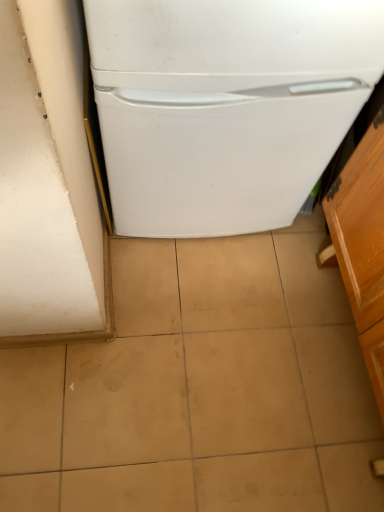
What do you see at coordinates (225, 106) in the screenshot? I see `white matte refrigerator at center` at bounding box center [225, 106].

Find the location of a particular element. The height and width of the screenshot is (512, 384). white matte refrigerator at center is located at coordinates (225, 106).

Image resolution: width=384 pixels, height=512 pixels. Describe the element at coordinates (363, 244) in the screenshot. I see `wooden cabinet at right` at that location.

This screenshot has width=384, height=512. What are the coordinates of `wooden cabinet at right` in the screenshot? It's located at (363, 244).

Measure the distance between point (x=354, y=155) and camera.

They are 1.08 meters apart.

In order to click on white matte refrigerator at center in this screenshot , I will do `click(225, 106)`.

Considering the relative positions of wooden cabinet at right and white matte refrigerator at center in the image provided, is wooden cabinet at right to the left of white matte refrigerator at center from the viewer's perspective?

No.

Is the position of wooden cabinet at right more distant than that of white matte refrigerator at center?

No, wooden cabinet at right is closer to the viewer.

Which is closer, (x=336, y=203) or (x=109, y=142)?

Point (x=336, y=203) is positioned farther from the camera compared to point (x=109, y=142).

From the image's perspective, who appears lower, wooden cabinet at right or white matte refrigerator at center?

From the image's view, wooden cabinet at right is below.

From a real-world perspective, who is located higher, wooden cabinet at right or white matte refrigerator at center?

white matte refrigerator at center is physically above.

From the picture: Is wooden cabinet at right wider than white matte refrigerator at center?

In fact, wooden cabinet at right might be narrower than white matte refrigerator at center.

Between wooden cabinet at right and white matte refrigerator at center, which one has less height?

wooden cabinet at right.

Between wooden cabinet at right and white matte refrigerator at center, which one has larger size?

Bigger between the two is white matte refrigerator at center.

Is wooden cabinet at right outside of white matte refrigerator at center?

wooden cabinet at right is positioned outside white matte refrigerator at center.

Is wooden cabinet at right not close to white matte refrigerator at center?

wooden cabinet at right is near white matte refrigerator at center, not far away.

Is wooden cabinet at right positioned with its back to white matte refrigerator at center?

wooden cabinet at right does not have its back to white matte refrigerator at center.

Consider the image. How many degrees apart are the facing directions of wooden cabinet at right and white matte refrigerator at center?

The facing directions of wooden cabinet at right and white matte refrigerator at center are 90 degrees apart.

Locate an element on the screen. The height and width of the screenshot is (512, 384). refrigerator on the left of the wooden cabinet at right is located at coordinates (225, 106).

In the image, is white matte refrigerator at center on the left side or the right side of wooden cabinet at right?

Based on their positions, white matte refrigerator at center is located to the left of wooden cabinet at right.

Is the depth of white matte refrigerator at center less than that of wooden cabinet at right?

No.

Is point (168, 156) behind point (365, 224)?

No, (168, 156) is closer to viewer.

From the image's perspective, does white matte refrigerator at center appear higher than wooden cabinet at right?

Correct, white matte refrigerator at center appears higher than wooden cabinet at right in the image.

From a real-world perspective, is white matte refrigerator at center beneath wooden cabinet at right?

No.

Which of these two, white matte refrigerator at center or wooden cabinet at right, is wider?

white matte refrigerator at center.

Is white matte refrigerator at center taller or shorter than wooden cabinet at right?

Clearly, white matte refrigerator at center is taller compared to wooden cabinet at right.

Is white matte refrigerator at center bigger or smaller than wooden cabinet at right?

Considering their sizes, white matte refrigerator at center takes up more space than wooden cabinet at right.

Is white matte refrigerator at center not within wooden cabinet at right?

Indeed, white matte refrigerator at center is completely outside wooden cabinet at right.

Is white matte refrigerator at center not near wooden cabinet at right?

No, white matte refrigerator at center is not far from wooden cabinet at right.

Does white matte refrigerator at center turn towards wooden cabinet at right?

No, white matte refrigerator at center is not oriented towards wooden cabinet at right.

How many degrees apart are the facing directions of white matte refrigerator at center and wooden cabinet at right?

Answer: The facing directions of white matte refrigerator at center and wooden cabinet at right are 90 degrees apart.

You are a GUI agent. You are given a task and a screenshot of the screen. Output one action in this format:
    pyautogui.click(x=<x>, y=<y>)
    Task: Click on the cabinetry lying below the white matte refrigerator at center (from the image's perspective)
    
    Given the screenshot: What is the action you would take?
    363,244

Where is `refrigerator above the wooden cabinet at right (from the image's perspective)`? The height and width of the screenshot is (512, 384). refrigerator above the wooden cabinet at right (from the image's perspective) is located at coordinates (225, 106).

Locate an element on the screen. refrigerator behind the wooden cabinet at right is located at coordinates (225, 106).